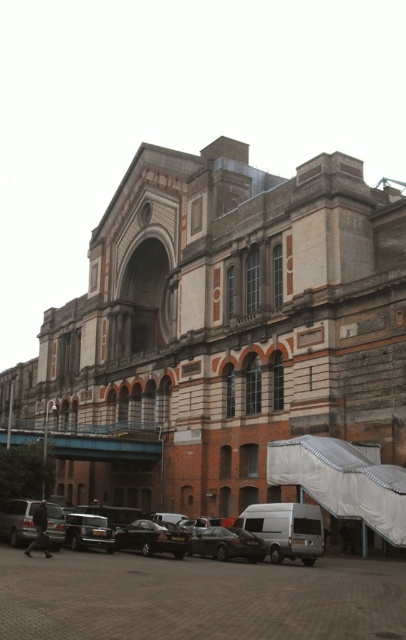
Between point (97, 605) and point (142, 529), which one is positioned in front?

Point (97, 605) is in front.

Can you confirm if black asphalt parking lot at lower center is thinner than shiny black sedan at center?

No.

This screenshot has width=406, height=640. What are the coordinates of `black asphalt parking lot at lower center` in the screenshot? It's located at (196, 598).

Does silver metallic van at lower center have a lesser width compared to silver metallic car at lower left?

In fact, silver metallic van at lower center might be wider than silver metallic car at lower left.

Is silver metallic van at lower center above silver metallic car at lower left?

Yes, silver metallic van at lower center is above silver metallic car at lower left.

The width and height of the screenshot is (406, 640). Identify the location of silver metallic van at lower center. (285, 529).

Between point (280, 444) and point (261, 540), which one is positioned in front?

Positioned in front is point (261, 540).

Is point (405, 540) farther from camera compared to point (256, 557)?

No.

Locate an element on the screen. The height and width of the screenshot is (640, 406). white textured canopy at lower right is located at coordinates (343, 481).

The image size is (406, 640). Find the location of `white textured canopy at lower right`. white textured canopy at lower right is located at coordinates (343, 481).